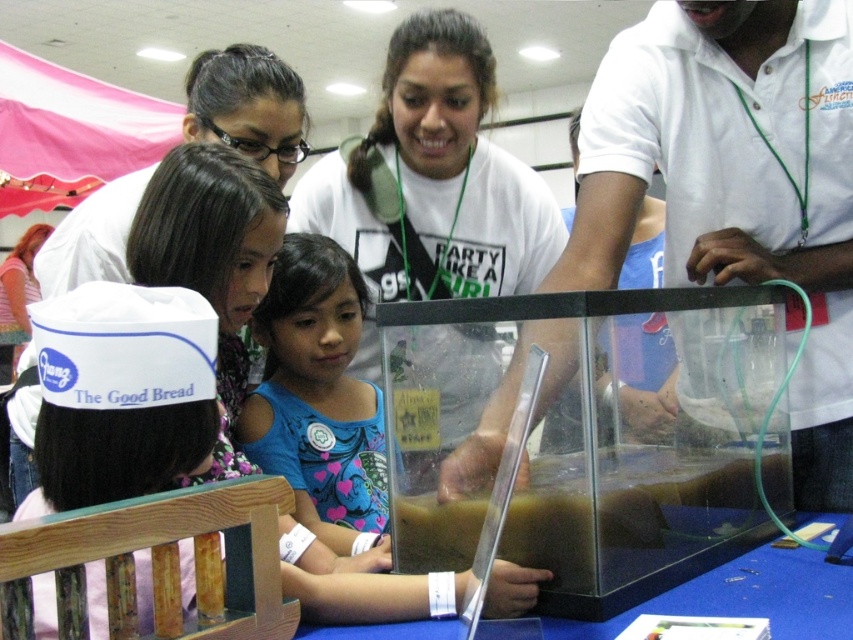
You are standing in front of the tank at the exhibit. If you want to place a small sensor at the point marked by the coordinates point (601, 449), where exactly would that be relative to the transparent glass tank at center?

The point (601, 449) marks the transparent glass tank at center, so placing the sensor there would place it directly on the tank itself.

You are standing in front of the blue tablecloth and see the transparent glass tank at center and the blue cotton shirt at center. Which object is positioned to the right of the other?

The transparent glass tank at center is to the right of the blue cotton shirt at center.